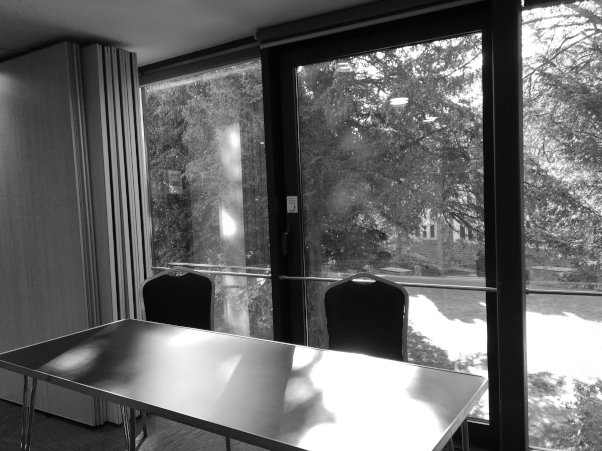
The width and height of the screenshot is (602, 451). I want to click on left bottom window glass, so point(253,300).